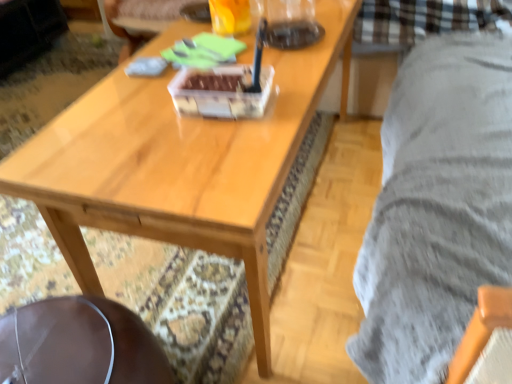
The image size is (512, 384). Identify the location of vacant region above wooden coffee table at center (from a real-world perspective). (220, 70).